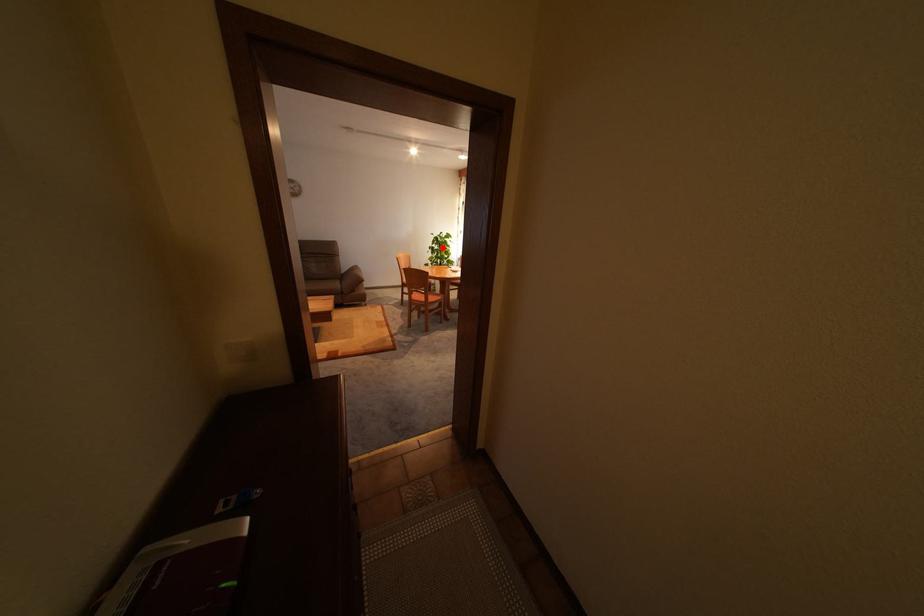
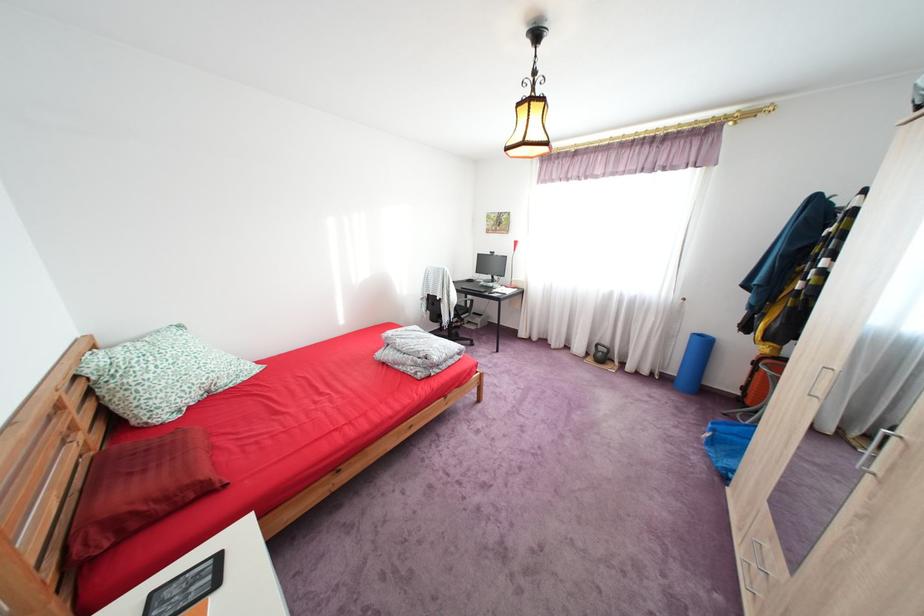
Question: I am providing you with two images of the same scene from different viewpoints. A red point is marked on the first image. At the location where the point appears in image 1, is it still visible in image 2?

Choices:
 (A) Yes
 (B) No

Answer: (B)